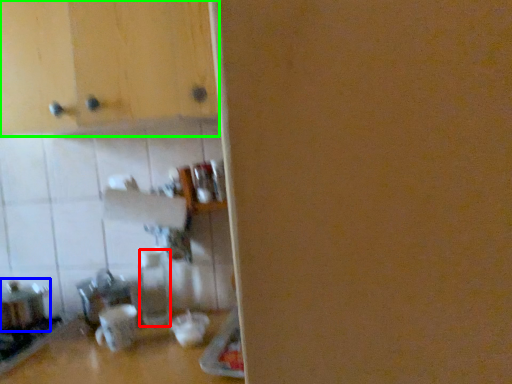
Question: Which object is positioned closest to bottle (highlighted by a red box)? Select from appliance (highlighted by a blue box) and cabinetry (highlighted by a green box).

Choices:
 (A) appliance
 (B) cabinetry

Answer: (A)